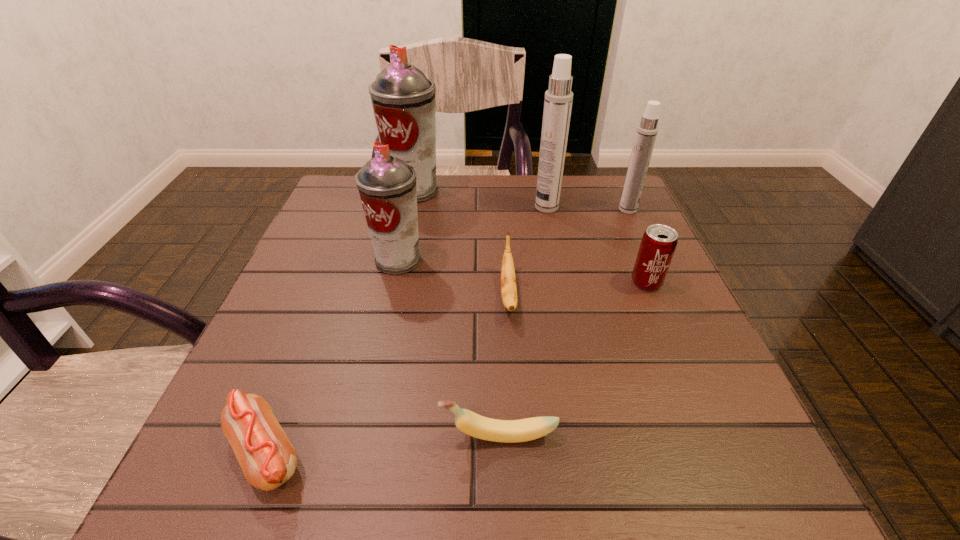
Identify the location of free space that satisfies the following two spatial constraints: 1. on the back side of the smaller white aerosol can; 2. on the right side of the brown sausage. (359, 210).

Locate an element on the screen. The image size is (960, 540). vacant space that satisfies the following two spatial constraints: 1. on the front side of the farther gray aerosol can; 2. on the left side of the sixth object from left to right is located at coordinates (410, 207).

You are a GUI agent. You are given a task and a screenshot of the screen. Output one action in this format:
    pyautogui.click(x=<x>, y=<y>)
    Task: Click on the free spot that satisfies the following two spatial constraints: 1. on the back side of the third aerosol can from left to right; 2. on the left side of the smaller gray aerosol can
    The width and height of the screenshot is (960, 540).
    Given the screenshot: What is the action you would take?
    pyautogui.click(x=410, y=207)

The image size is (960, 540). What are the coordinates of `vacant space that satisfies the following two spatial constraints: 1. on the front side of the left white aerosol can; 2. on the left side of the beer can` in the screenshot? It's located at (563, 282).

Where is `vacant area that satisfies the following two spatial constraints: 1. on the front side of the sixth object from left to right; 2. on the left side of the fourth shortest object`? The image size is (960, 540). vacant area that satisfies the following two spatial constraints: 1. on the front side of the sixth object from left to right; 2. on the left side of the fourth shortest object is located at coordinates (563, 282).